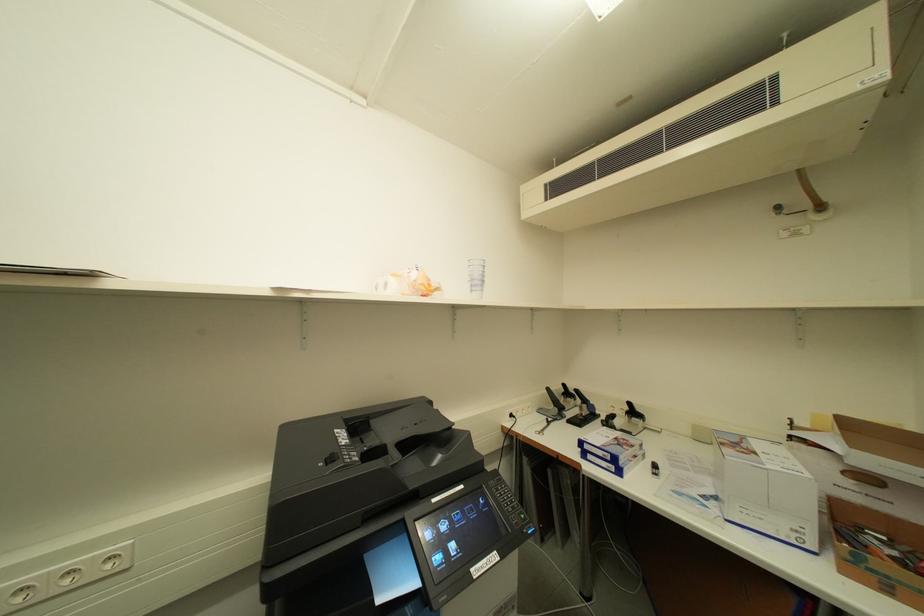
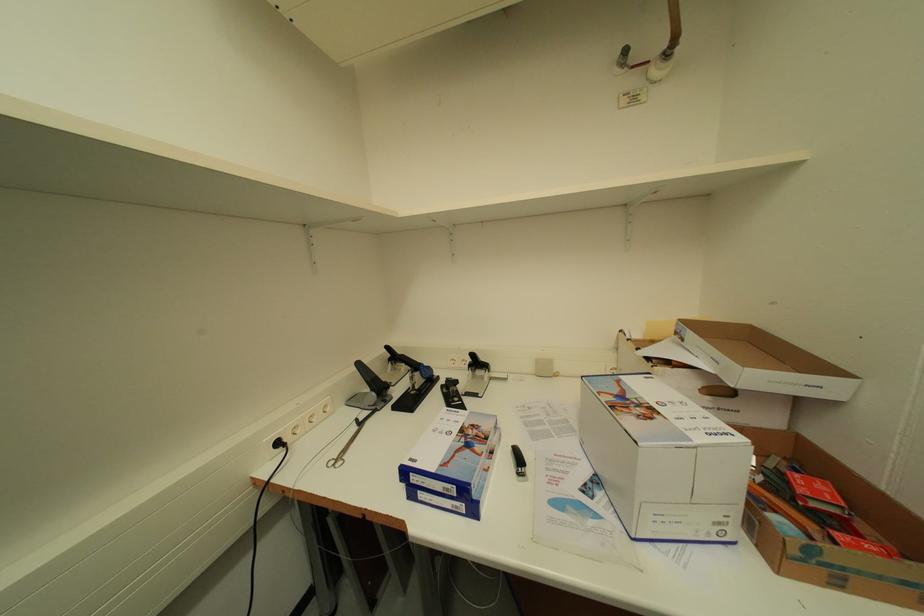
Question: How did the camera likely rotate?

Choices:
 (A) Left
 (B) Right
 (C) Up
 (D) Down

Answer: (B)